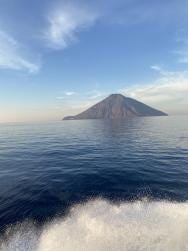
At what (x,y) coordinates should I click in order to perform the action: click on island right side. Please return your answer as a coordinate pair (x, y). Looking at the image, I should click on (166, 113).